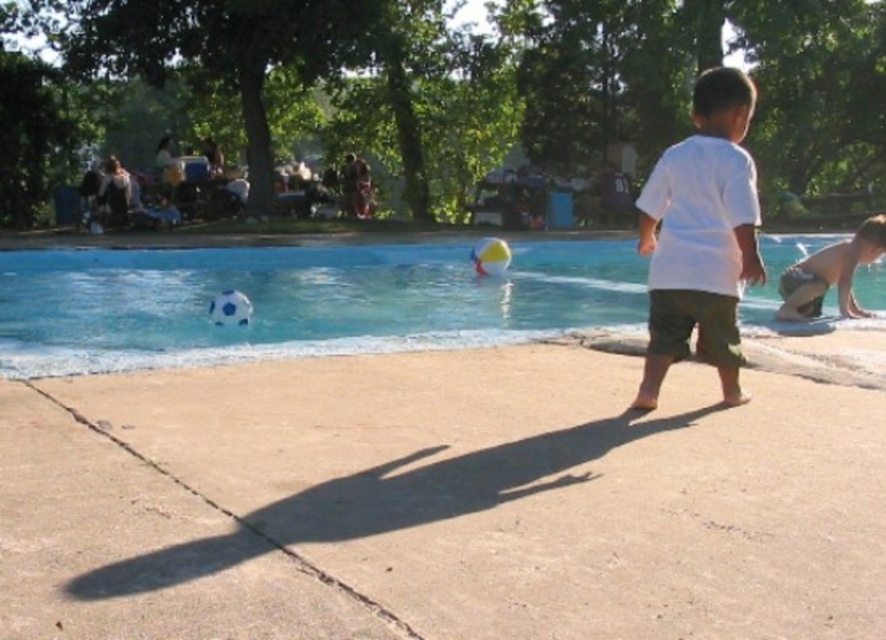
Question: Can you confirm if blue rubber ball at lower center is wider than white cotton shirt at center?

Choices:
 (A) yes
 (B) no

Answer: (A)

Question: Does white cotton shirt at center appear under tan skin boy at right?

Choices:
 (A) yes
 (B) no

Answer: (B)

Question: Which of the following is the closest to the observer?

Choices:
 (A) tap(877, 216)
 (B) tap(729, 132)
 (C) tap(157, 317)

Answer: (B)

Question: Which object is the farthest from the tan skin boy at right?

Choices:
 (A) white cotton shirt at center
 (B) blue rubber ball at lower center

Answer: (B)

Question: Is blue rubber ball at lower center wider than tan skin boy at right?

Choices:
 (A) no
 (B) yes

Answer: (B)

Question: Among these points, which one is nearest to the camera?

Choices:
 (A) (482, 282)
 (B) (649, 340)

Answer: (B)